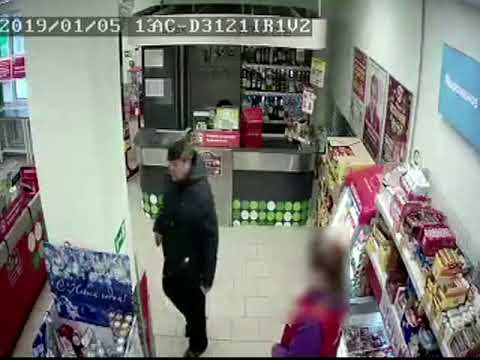
This screenshot has height=360, width=480. Identify the location of metal shelving. [x=410, y=266], [x=387, y=298].